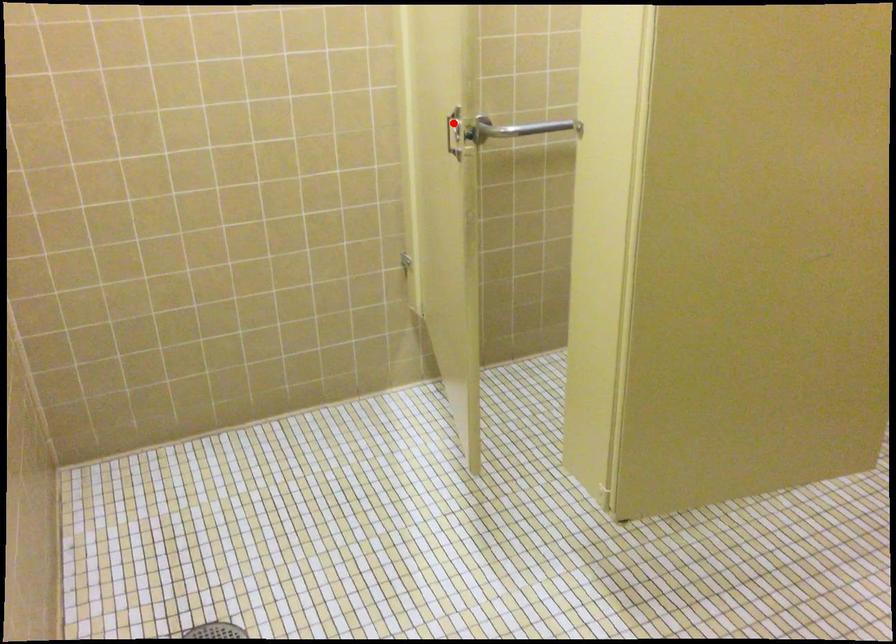
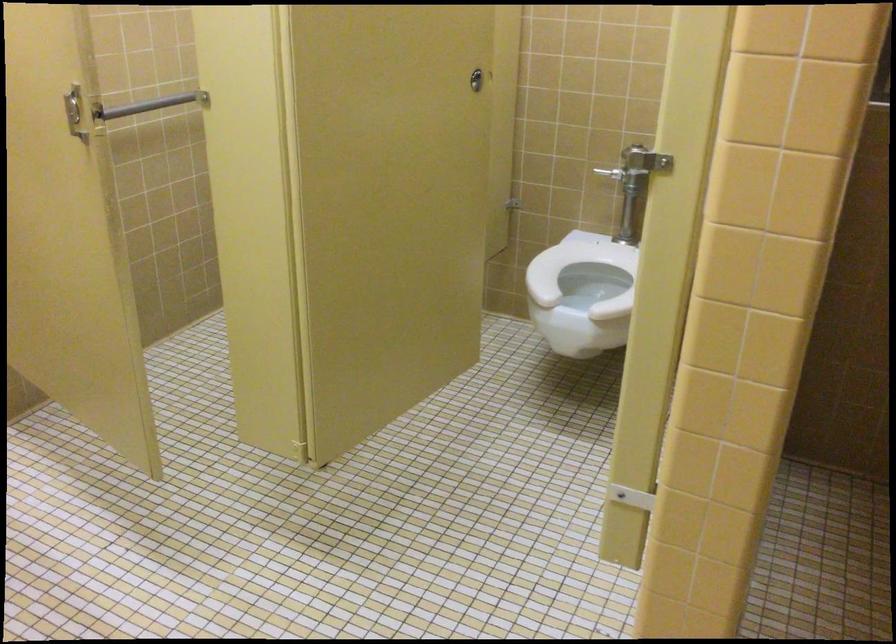
Locate, in the second image, the point that corresponds to the highlighted location in the first image.

(74, 111)